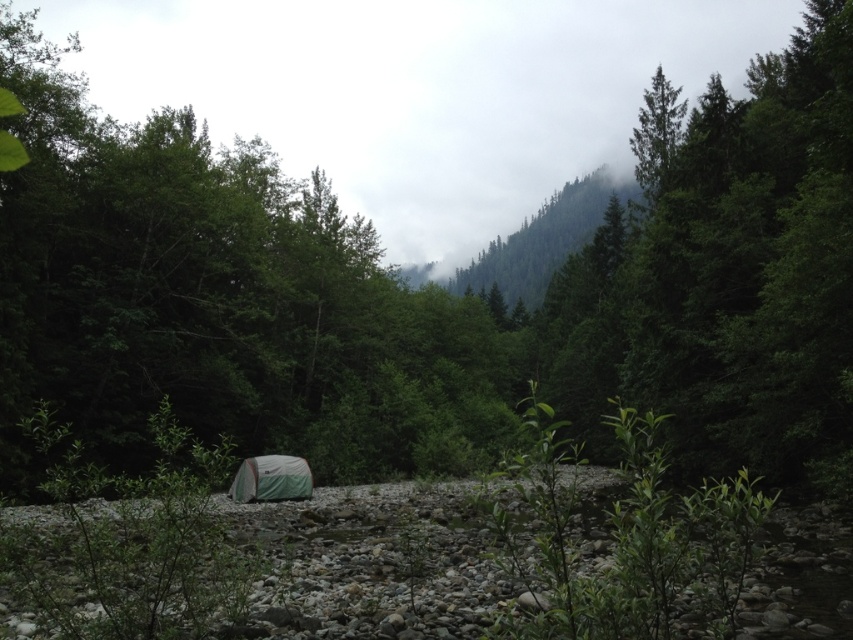
You are standing at point (306,461) and want to walk towards the mountain in the background. Is the point (633,150) in front of or behind you as you face the mountains?

Point (633,150) is behind point (306,461), so when facing the mountains, the point (633,150) would be behind you.